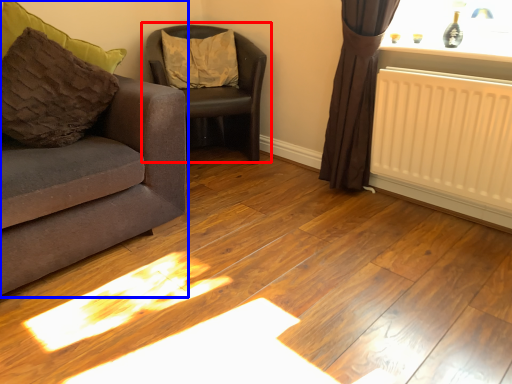
Question: Which object is further to the camera taking this photo, chair (highlighted by a red box) or studio couch (highlighted by a blue box)?

Choices:
 (A) chair
 (B) studio couch

Answer: (A)